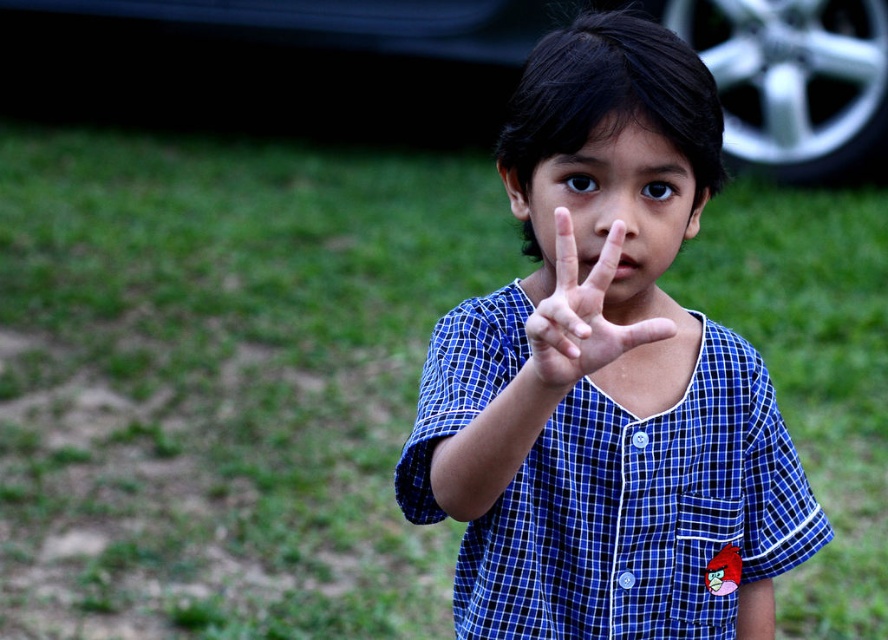
Question: Can you confirm if blue checkered shirt at center is positioned below blue plaid shirt at center?

Choices:
 (A) yes
 (B) no

Answer: (A)

Question: Does blue checkered shirt at center appear on the right side of metallic silver car at upper right?

Choices:
 (A) no
 (B) yes

Answer: (A)

Question: Which is nearer to the metallic silver car at upper right?

Choices:
 (A) blue plaid shirt at center
 (B) blue checkered shirt at center

Answer: (B)

Question: Can you confirm if blue checkered shirt at center is wider than metallic silver car at upper right?

Choices:
 (A) no
 (B) yes

Answer: (A)

Question: Which is nearer to the blue checkered shirt at center?

Choices:
 (A) blue plaid shirt at center
 (B) metallic silver car at upper right

Answer: (A)

Question: Which point appears farthest from the camera in this image?

Choices:
 (A) (661, 317)
 (B) (715, 554)
 (C) (845, 104)

Answer: (C)